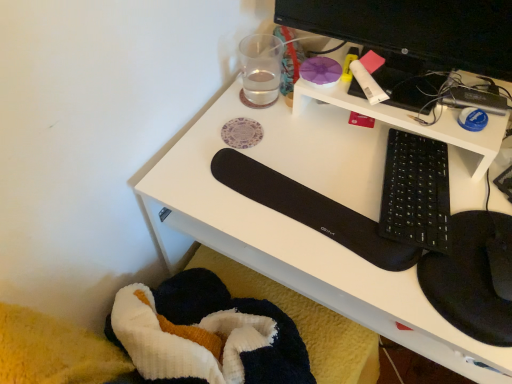
Image resolution: width=512 pixels, height=384 pixels. I want to click on vacant space positioned to the left of black matte keyboard at center-right, so click(x=306, y=176).